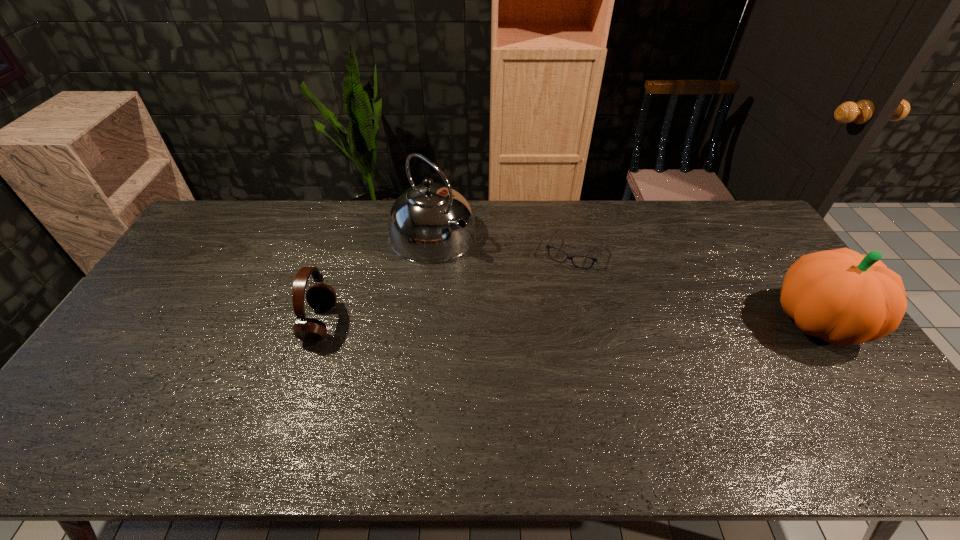
At what (x,y) coordinates should I click in order to perform the action: click on headset. Please return your answer as a coordinate pair (x, y). Looking at the image, I should click on (321, 297).

Identify the location of the second shortest object. (321, 297).

This screenshot has width=960, height=540. Find the location of `the rightmost object`. the rightmost object is located at coordinates (840, 296).

Find the location of a particular element. Image resolution: width=960 pixels, height=540 pixels. spectacles is located at coordinates (548, 246).

The height and width of the screenshot is (540, 960). I want to click on the shortest object, so click(548, 246).

Locate an element on the screen. The height and width of the screenshot is (540, 960). the third object from right to left is located at coordinates (430, 223).

This screenshot has height=540, width=960. What are the coordinates of `free space located 0.050m on the ear pads of the leftmost object` in the screenshot? It's located at (352, 323).

Where is `vacant space located on the back of the rightmost object`? This screenshot has height=540, width=960. vacant space located on the back of the rightmost object is located at coordinates (787, 277).

Image resolution: width=960 pixels, height=540 pixels. I want to click on free space located on the front-facing side of the shortest object, so click(547, 308).

Locate an element on the screen. This screenshot has width=960, height=540. vacant region located 0.380m on the front-facing side of the shortest object is located at coordinates (525, 359).